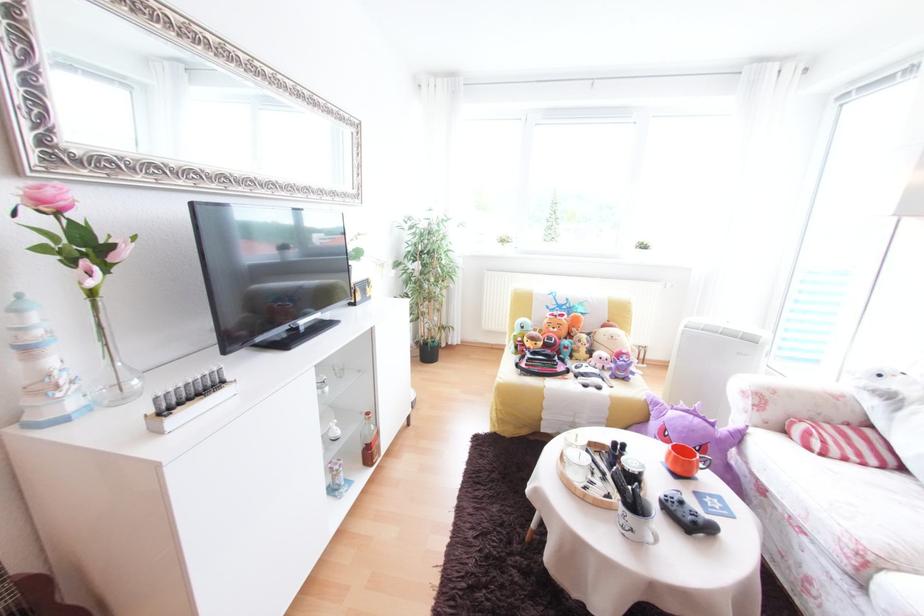
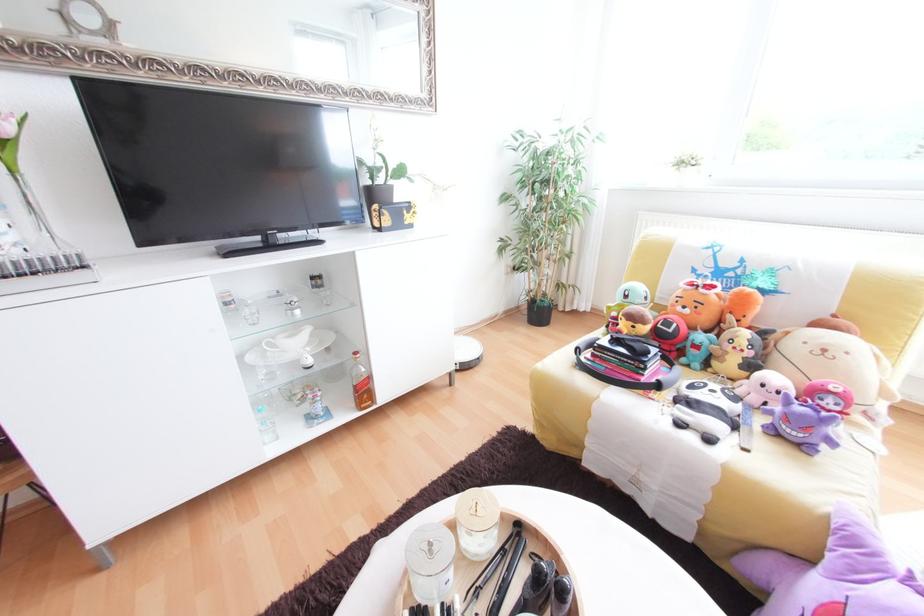
Where in the second image is the point corresponding to point (574, 349) from the first image?

(704, 347)